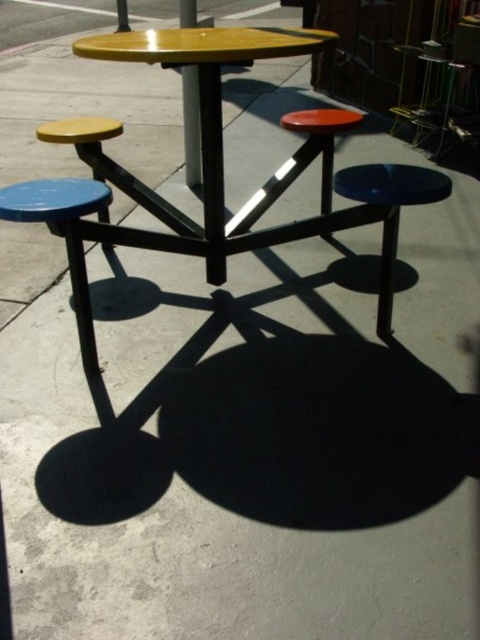
Question: Among these objects, which one is farthest from the camera?

Choices:
 (A) matte yellow stool at left
 (B) yellow matte pole at center

Answer: (B)

Question: Estimate the real-world distances between objects in this image. Which object is farther from the metallic pole at upper center?

Choices:
 (A) yellow matte pole at center
 (B) blue matte stool at center
 (C) matte yellow stool at left
 (D) shiny orange stool at center

Answer: (B)

Question: Which object appears farthest from the camera in this image?

Choices:
 (A) blue painted metal stool at left
 (B) blue matte stool at center
 (C) yellow matte pole at center

Answer: (C)

Question: Is shiny orange stool at center to the left of yellow matte pole at center from the viewer's perspective?

Choices:
 (A) yes
 (B) no

Answer: (B)

Question: Can you confirm if blue matte stool at center is positioned above matte yellow stool at left?

Choices:
 (A) yes
 (B) no

Answer: (B)

Question: Does blue matte stool at center have a larger size compared to metallic pole at upper center?

Choices:
 (A) no
 (B) yes

Answer: (A)